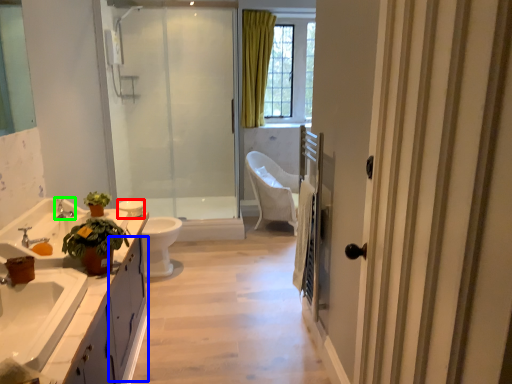
Question: Based on their relative distances, which object is nearer to toilet bowl (highlighted by a red box)? Choose from cabinetry (highlighted by a blue box) and tap (highlighted by a green box).

Choices:
 (A) cabinetry
 (B) tap

Answer: (B)